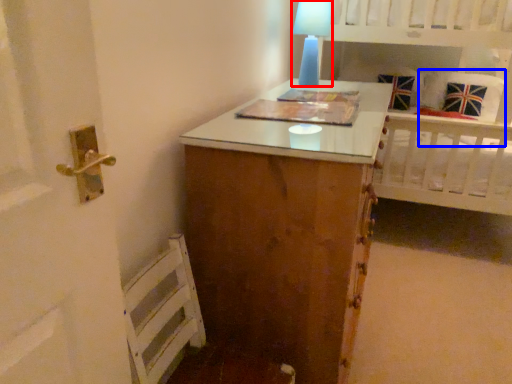
Question: Among these objects, which one is nearest to the camera, table lamp (highlighted by a red box) or pillow (highlighted by a blue box)?

Choices:
 (A) table lamp
 (B) pillow

Answer: (A)